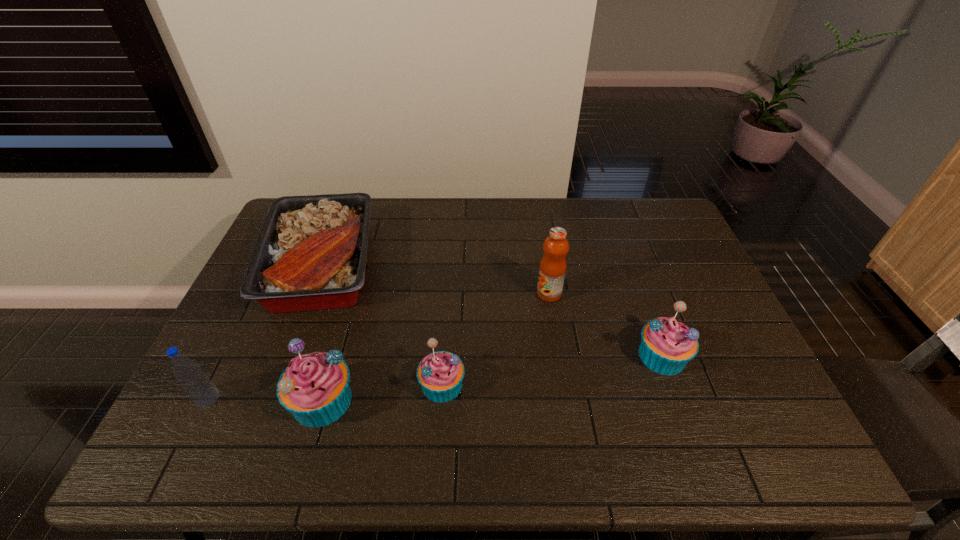
The image size is (960, 540). Find the location of `vacant space located on the back of the second muffin from left to right`. vacant space located on the back of the second muffin from left to right is located at coordinates (448, 297).

Locate an element on the screen. The image size is (960, 540). free spot located on the left of the rightmost muffin is located at coordinates (497, 356).

Find the location of a particular element. The height and width of the screenshot is (540, 960). vacant space located on the front label of the second object from right to left is located at coordinates (487, 294).

I want to click on vacant space located on the front label of the second object from right to left, so click(x=453, y=294).

What are the coordinates of `vacant space located on the front label of the second object from right to left` in the screenshot? It's located at (493, 294).

Where is `blank area located on the front of the tray`? This screenshot has height=540, width=960. blank area located on the front of the tray is located at coordinates (277, 379).

The width and height of the screenshot is (960, 540). I want to click on vacant space situated 0.240m on the back of the water bottle, so click(249, 314).

This screenshot has height=540, width=960. In order to click on object at the far edge in this screenshot , I will do click(x=310, y=255).

Image resolution: width=960 pixels, height=540 pixels. Find the location of `water bottle that is at the near edge`. water bottle that is at the near edge is located at coordinates [195, 382].

I want to click on tray at the left edge, so click(x=310, y=255).